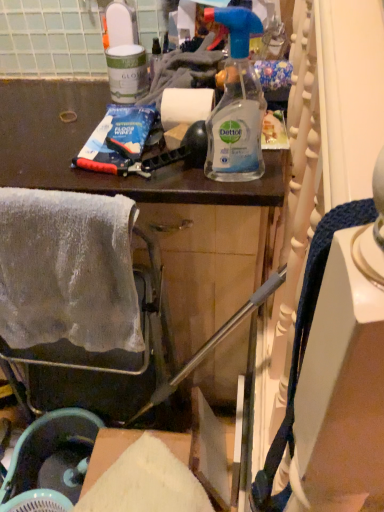
Where is `matte black cabinet at upper center`? matte black cabinet at upper center is located at coordinates (105, 174).

What do you see at coordinates (68, 270) in the screenshot? I see `white fluffy towel at left` at bounding box center [68, 270].

Locate an element on the screen. This screenshot has height=512, width=384. white matte paper towel at center is located at coordinates (185, 106).

This screenshot has height=512, width=384. In order to click on matte black cabinet at upper center in this screenshot , I will do `click(105, 174)`.

Considering the sizes of white fluffy towel at left and white matte paper towel at center in the image, is white fluffy towel at left bigger or smaller than white matte paper towel at center?

In the image, white fluffy towel at left appears to be larger than white matte paper towel at center.

How distant is white fluffy towel at left from white matte paper towel at center?

white fluffy towel at left is 15.28 inches from white matte paper towel at center.

Visually, is white fluffy towel at left positioned to the left or to the right of white matte paper towel at center?

white fluffy towel at left is positioned on white matte paper towel at center's left side.

From their relative heights in the image, would you say white fluffy towel at left is taller or shorter than white matte paper towel at center?

In the image, white fluffy towel at left appears to be taller than white matte paper towel at center.

From a real-world perspective, which object rests below the other?

In real-world perspective, white fluffy towel at left is lower.

From the image's perspective, is white matte paper towel at center on top of white fluffy towel at left?

Correct, white matte paper towel at center appears higher than white fluffy towel at left in the image.

Find the location of `bottle on the left of white matte paper towel at center`. bottle on the left of white matte paper towel at center is located at coordinates pyautogui.click(x=127, y=73).

From a real-world perspective, which object stands above the other?

white glossy paint can at upper left, the 1th bottle when ordered from top to bottom, is physically above.

Who is smaller, white matte paper towel at center or white glossy paint can at upper left, the 1th bottle when ordered from top to bottom?

With smaller size is white matte paper towel at center.

Considering the positions of objects white matte paper towel at center and white glossy paint can at upper left, which is the second bottle in front-to-back order, in the image provided, who is more to the left, white matte paper towel at center or white glossy paint can at upper left, which is the second bottle in front-to-back order,?

From the viewer's perspective, white glossy paint can at upper left, which is the second bottle in front-to-back order, appears more on the left side.

Who is taller, white glossy paint can at upper left, the 2th bottle from the right, or matte black cabinet at upper center?

Standing taller between the two is matte black cabinet at upper center.

Relative to matte black cabinet at upper center, is white glossy paint can at upper left, the 1th bottle when ordered from left to right, in front or behind?

In the image, white glossy paint can at upper left, the 1th bottle when ordered from left to right, appears behind matte black cabinet at upper center.

Which object is positioned more to the left, white glossy paint can at upper left, the 1th bottle when ordered from left to right, or matte black cabinet at upper center?

From the viewer's perspective, matte black cabinet at upper center appears more on the left side.

Is white glossy paint can at upper left, which is the second bottle in front-to-back order, completely or partially outside of matte black cabinet at upper center?

Indeed, white glossy paint can at upper left, which is the second bottle in front-to-back order, is completely outside matte black cabinet at upper center.

From the picture: Considering the sizes of objects clear plastic spray bottle at center, the first bottle viewed from the front, and matte black cabinet at upper center in the image provided, who is smaller, clear plastic spray bottle at center, the first bottle viewed from the front, or matte black cabinet at upper center?

With smaller size is clear plastic spray bottle at center, the first bottle viewed from the front.

Is clear plastic spray bottle at center, which is counted as the second bottle, starting from the back, in contact with matte black cabinet at upper center?

clear plastic spray bottle at center, which is counted as the second bottle, starting from the back, and matte black cabinet at upper center are clearly separated.

Which of these two, clear plastic spray bottle at center, marked as the 1th bottle in a right-to-left arrangement, or matte black cabinet at upper center, stands taller?

matte black cabinet at upper center.

In the scene shown: How distant is white glossy paint can at upper left, the 1th bottle when ordered from left to right, from clear plastic spray bottle at center, placed as the second bottle when sorted from top to bottom?

They are 31.37 centimeters apart.

Does white glossy paint can at upper left, the 2th bottle from the right, come behind clear plastic spray bottle at center, the first bottle in the bottom-to-top sequence?

Yes.

Is white glossy paint can at upper left, which is the second bottle in front-to-back order, facing away from clear plastic spray bottle at center, the first bottle in the bottom-to-top sequence?

white glossy paint can at upper left, which is the second bottle in front-to-back order, does not have its back to clear plastic spray bottle at center, the first bottle in the bottom-to-top sequence.

Which of these two, white glossy paint can at upper left, the 1th bottle when ordered from top to bottom, or clear plastic spray bottle at center, the first bottle viewed from the front, is thinner?

clear plastic spray bottle at center, the first bottle viewed from the front.

Between clear plastic spray bottle at center, the first bottle viewed from the front, and white matte paper towel at center, which one has larger width?

white matte paper towel at center is wider.

Considering the sizes of objects clear plastic spray bottle at center, acting as the 2th bottle starting from the left, and white matte paper towel at center in the image provided, who is taller, clear plastic spray bottle at center, acting as the 2th bottle starting from the left, or white matte paper towel at center?

clear plastic spray bottle at center, acting as the 2th bottle starting from the left, is taller.

Can we say clear plastic spray bottle at center, which is counted as the second bottle, starting from the back, lies outside white matte paper towel at center?

Absolutely, clear plastic spray bottle at center, which is counted as the second bottle, starting from the back, is external to white matte paper towel at center.

Find the location of `towel/napkin below the white matte paper towel at center (from a real-world perspective)`. towel/napkin below the white matte paper towel at center (from a real-world perspective) is located at coordinates (68, 270).

Locate an element on the screen. The width and height of the screenshot is (384, 512). paper towel lying on the right of white fluffy towel at left is located at coordinates (185, 106).

Estimate the real-world distances between objects in this image. Which object is closer to white fluffy towel at left, white matte paper towel at center or white glossy paint can at upper left, the 2th bottle from the right?

white matte paper towel at center is positioned closer to the anchor white fluffy towel at left.

Which object lies nearer to the anchor point white fluffy towel at left, matte black cabinet at upper center or clear plastic spray bottle at center, which is counted as the second bottle, starting from the back?

The object closer to white fluffy towel at left is matte black cabinet at upper center.

From the picture: Based on their spatial positions, is white fluffy towel at left or clear plastic spray bottle at center, the first bottle in the bottom-to-top sequence, closer to white matte paper towel at center?

clear plastic spray bottle at center, the first bottle in the bottom-to-top sequence, is positioned closer to the anchor white matte paper towel at center.

Based on their spatial positions, is white matte paper towel at center or clear plastic spray bottle at center, the first bottle in the bottom-to-top sequence, further from white fluffy towel at left?

Among the two, white matte paper towel at center is located further to white fluffy towel at left.

Looking at the image, which one is located closer to white fluffy towel at left, white glossy paint can at upper left, the 2th bottle from the right, or clear plastic spray bottle at center, which is counted as the second bottle, starting from the back?

clear plastic spray bottle at center, which is counted as the second bottle, starting from the back, is positioned closer to the anchor white fluffy towel at left.

When comparing their distances from white glossy paint can at upper left, which is the second bottle in front-to-back order, does white fluffy towel at left or matte black cabinet at upper center seem closer?

matte black cabinet at upper center lies closer to white glossy paint can at upper left, which is the second bottle in front-to-back order, than the other object.

Considering their positions, is matte black cabinet at upper center positioned closer to white matte paper towel at center than white fluffy towel at left?

Based on the image, matte black cabinet at upper center appears to be nearer to white matte paper towel at center.

Estimate the real-world distances between objects in this image. Which object is further from clear plastic spray bottle at center, placed as the second bottle when sorted from top to bottom, white matte paper towel at center or white glossy paint can at upper left, the 1th bottle when ordered from top to bottom?

white glossy paint can at upper left, the 1th bottle when ordered from top to bottom, is further to clear plastic spray bottle at center, placed as the second bottle when sorted from top to bottom.

This screenshot has width=384, height=512. I want to click on bottle between white matte paper towel at center and white fluffy towel at left from top to bottom, so click(x=236, y=104).

This screenshot has width=384, height=512. I want to click on paper towel between white glossy paint can at upper left, marked as the 2th bottle in a bottom-to-top arrangement, and white fluffy towel at left in the up-down direction, so click(185, 106).

The height and width of the screenshot is (512, 384). What are the coordinates of `cabinetry between white fluffy towel at left and clear plastic spray bottle at center, which is counted as the second bottle, starting from the back, in the horizontal direction` in the screenshot? It's located at (105, 174).

Find the location of a particular element. The height and width of the screenshot is (512, 384). cabinetry between white glossy paint can at upper left, the 2th bottle from the right, and white fluffy towel at left from top to bottom is located at coordinates (105, 174).